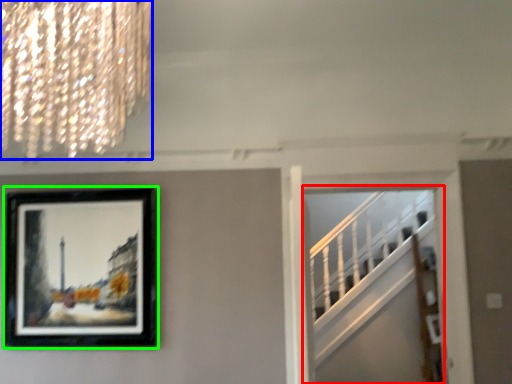
Question: Which is nearer to the escalator (highlighted by a red box)? lamp (highlighted by a blue box) or picture frame (highlighted by a green box).

Choices:
 (A) lamp
 (B) picture frame

Answer: (B)